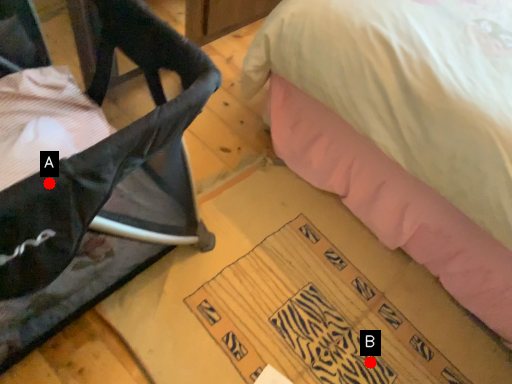
Question: Two points are circled on the image, labeled by A and B beside each circle. Which point is closer to the camera?

Choices:
 (A) A is closer
 (B) B is closer

Answer: (A)